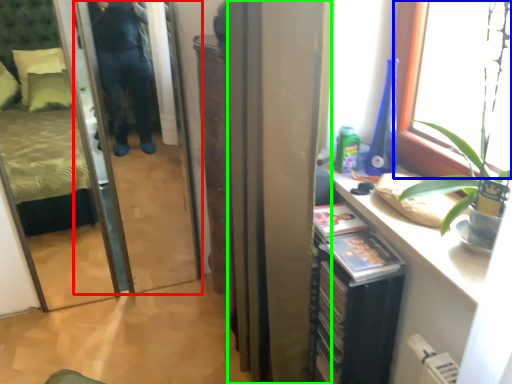
Question: Considering the real-world distances, which object is farthest from screen door (highlighted by a red box)? window (highlighted by a blue box) or curtain (highlighted by a green box)?

Choices:
 (A) window
 (B) curtain

Answer: (A)